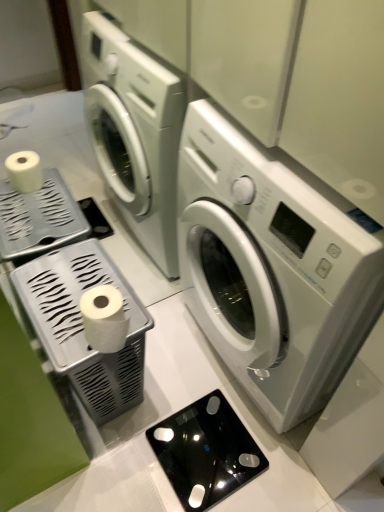
Identify the location of vacant space to the left of black glass scale at lower center, placed as the 2th appliance when sorted from left to right. (128, 451).